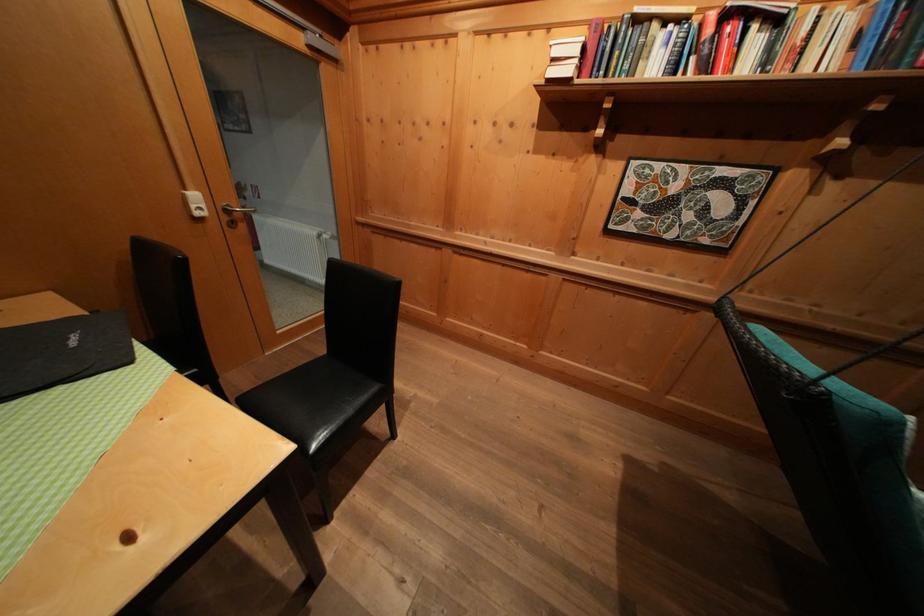
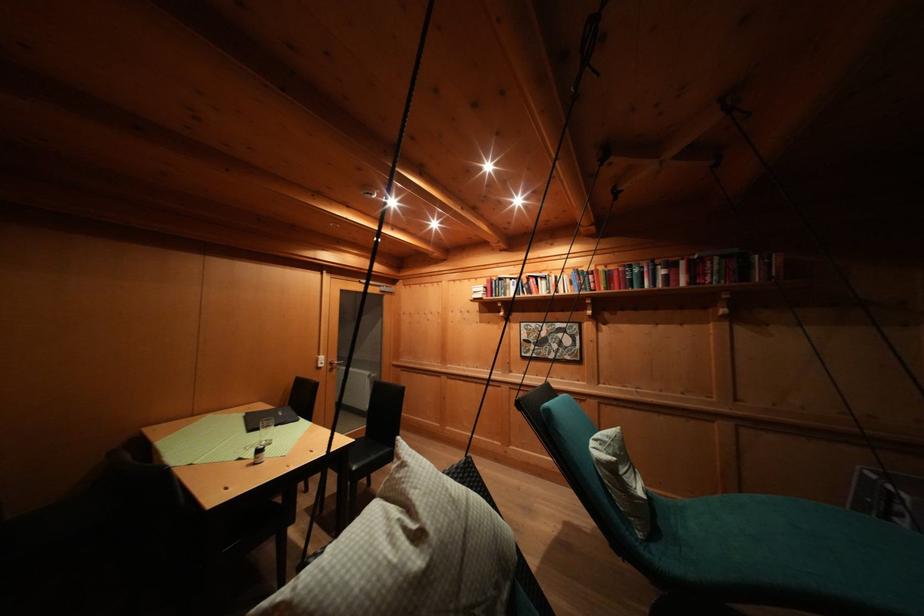
Find the pixel in the second image that matches point (661, 31) in the first image.

(514, 285)